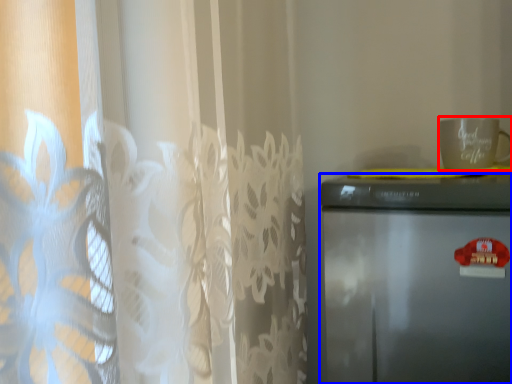
Question: Which of the following is the farthest to the observer, mug (highlighted by a red box) or refrigerator (highlighted by a blue box)?

Choices:
 (A) mug
 (B) refrigerator

Answer: (A)